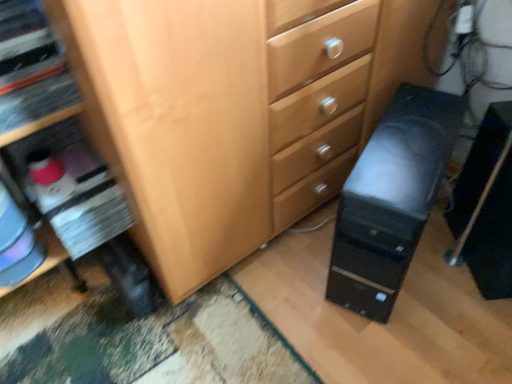
The image size is (512, 384). What are the coordinates of `free space to the left of black plastic computer tower at lower right, which is the first computer tower from left to right` in the screenshot? It's located at (283, 281).